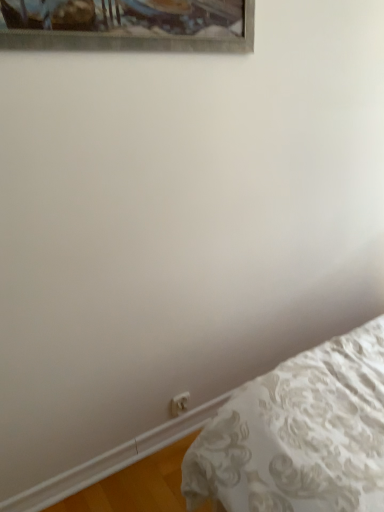
What do you see at coordinates (179, 403) in the screenshot? I see `white plastic electric outlet at lower center` at bounding box center [179, 403].

Image resolution: width=384 pixels, height=512 pixels. In order to click on white plastic electric outlet at lower center in this screenshot , I will do `click(179, 403)`.

Measure the distance between white plastic electric outlet at lower center and camera.

The depth of white plastic electric outlet at lower center is 1.63 meters.

This screenshot has height=512, width=384. I want to click on white textured bed at lower right, so click(299, 434).

In order to face white textured bed at lower right, should I rotate leftwards or rightwards?

Rotate right and turn 6.737 degrees.

The image size is (384, 512). Describe the element at coordinates (299, 434) in the screenshot. I see `white textured bed at lower right` at that location.

Where is `white plastic electric outlet at lower center`? This screenshot has width=384, height=512. white plastic electric outlet at lower center is located at coordinates (179, 403).

Considering the relative positions of white textured bed at lower right and white plastic electric outlet at lower center in the image provided, is white textured bed at lower right to the right of white plastic electric outlet at lower center from the viewer's perspective?

Yes.

Considering the positions of objects white textured bed at lower right and white plastic electric outlet at lower center in the image provided, who is in front, white textured bed at lower right or white plastic electric outlet at lower center?

white textured bed at lower right is closer to the camera.

Which is closer to the camera, (220, 488) or (174, 409)?

Point (220, 488) appears to be closer to the viewer than point (174, 409).

From the image's perspective, which object appears higher, white textured bed at lower right or white plastic electric outlet at lower center?

white plastic electric outlet at lower center appears higher in the image.

From a real-world perspective, is white textured bed at lower right under white plastic electric outlet at lower center?

Yes.

Can you confirm if white textured bed at lower right is thinner than white plastic electric outlet at lower center?

In fact, white textured bed at lower right might be wider than white plastic electric outlet at lower center.

Looking at this image, can you confirm if white textured bed at lower right is taller than white plastic electric outlet at lower center?

In fact, white textured bed at lower right may be shorter than white plastic electric outlet at lower center.

Between white textured bed at lower right and white plastic electric outlet at lower center, which one has smaller size?

Smaller between the two is white plastic electric outlet at lower center.

Is white textured bed at lower right situated inside white plastic electric outlet at lower center or outside?

white textured bed at lower right is not inside white plastic electric outlet at lower center, it's outside.

Is white textured bed at lower right with white plastic electric outlet at lower center?

No.

Is white plastic electric outlet at lower center at the back of white textured bed at lower right?

No, white textured bed at lower right's orientation is not away from white plastic electric outlet at lower center.

You are a GUI agent. You are given a task and a screenshot of the screen. Output one action in this format:
    pyautogui.click(x=<x>, y=<y>)
    Task: Click on the electric outlet above the white textured bed at lower right (from a real-world perspective)
    
    Given the screenshot: What is the action you would take?
    pyautogui.click(x=179, y=403)

Which object is positioned more to the right, white plastic electric outlet at lower center or white textured bed at lower right?

white textured bed at lower right.

Is white plastic electric outlet at lower center further to camera compared to white textured bed at lower right?

Yes, white plastic electric outlet at lower center is further from the viewer.

Which is nearer, (181, 408) or (298, 367)?

Clearly, point (181, 408) is more distant from the camera than point (298, 367).

From the image's perspective, is white plastic electric outlet at lower center located beneath white textured bed at lower right?

Incorrect, from the image's perspective, white plastic electric outlet at lower center is higher than white textured bed at lower right.

In the scene shown: From a real-world perspective, which is physically below, white plastic electric outlet at lower center or white textured bed at lower right?

In real-world perspective, white textured bed at lower right is lower.

Which of these two, white plastic electric outlet at lower center or white textured bed at lower right, is wider?

With larger width is white textured bed at lower right.

Considering the sizes of objects white plastic electric outlet at lower center and white textured bed at lower right in the image provided, who is shorter, white plastic electric outlet at lower center or white textured bed at lower right?

With less height is white textured bed at lower right.

Looking at the image, does white plastic electric outlet at lower center seem bigger or smaller compared to white textured bed at lower right?

Clearly, white plastic electric outlet at lower center is smaller in size than white textured bed at lower right.

Do you think white plastic electric outlet at lower center is within white textured bed at lower right, or outside of it?

white plastic electric outlet at lower center lies outside white textured bed at lower right.

Is white plastic electric outlet at lower center positioned far away from white textured bed at lower right?

Actually, white plastic electric outlet at lower center and white textured bed at lower right are a little close together.

Consider the image. Is white plastic electric outlet at lower center facing away from white textured bed at lower right?

No, white plastic electric outlet at lower center's orientation is not away from white textured bed at lower right.

How many degrees apart are the facing directions of white plastic electric outlet at lower center and white textured bed at lower right?

white plastic electric outlet at lower center and white textured bed at lower right are facing 0.0173 degrees away from each other.

Locate an element on the screen. The height and width of the screenshot is (512, 384). bed on the right of white plastic electric outlet at lower center is located at coordinates (299, 434).

Locate an element on the screen. This screenshot has height=512, width=384. bed that appears on the right of white plastic electric outlet at lower center is located at coordinates (299, 434).

Locate an element on the screen. electric outlet above the white textured bed at lower right (from a real-world perspective) is located at coordinates (179, 403).